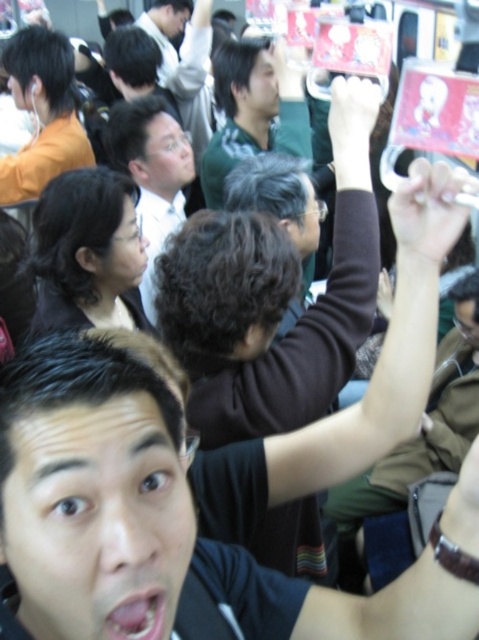
Is brown fuzzy sweater at upper center shorter than matte black shirt at center?

Incorrect, brown fuzzy sweater at upper center's height does not fall short of matte black shirt at center's.

Describe the element at coordinates (273, 300) in the screenshot. I see `brown fuzzy sweater at upper center` at that location.

Locate an element on the screen. The image size is (479, 640). brown fuzzy sweater at upper center is located at coordinates (273, 300).